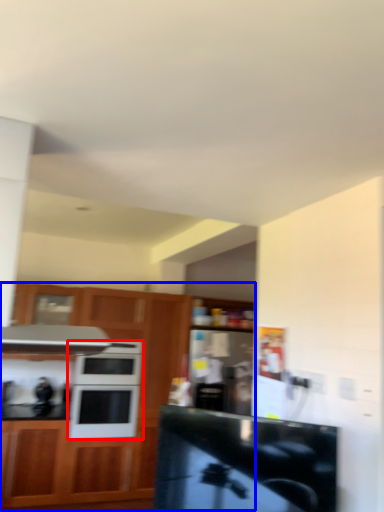
Question: Among these objects, which one is farthest to the camera, microwave oven (highlighted by a red box) or cabinetry (highlighted by a blue box)?

Choices:
 (A) microwave oven
 (B) cabinetry

Answer: (A)